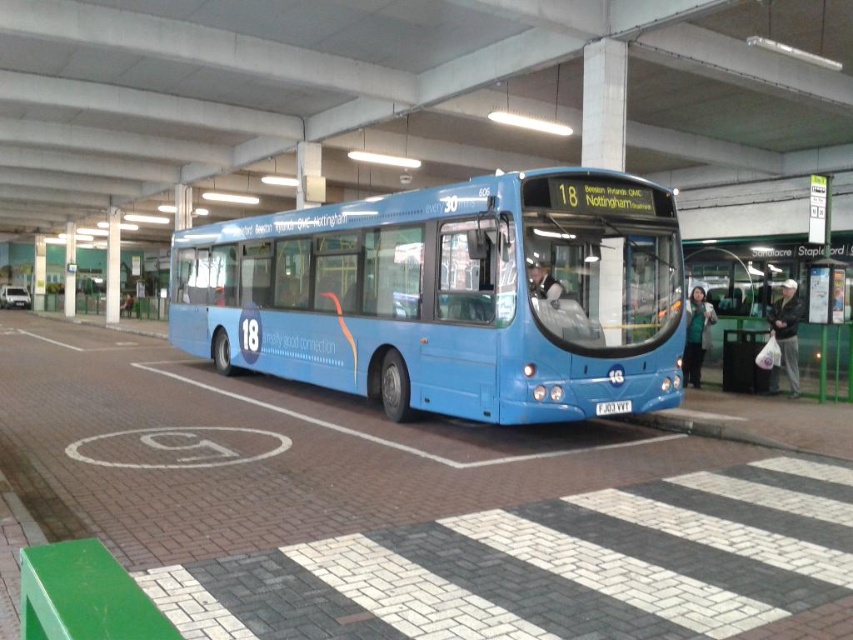
Looking at this image, which is below, matte blue bus at center or green plastic bus stop at center?

matte blue bus at center is lower down.

Looking at this image, can you confirm if matte blue bus at center is bigger than green plastic bus stop at center?

Correct, matte blue bus at center is larger in size than green plastic bus stop at center.

Is point (310, 236) closer to camera compared to point (724, 288)?

Yes.

Locate an element on the screen. This screenshot has height=640, width=853. matte blue bus at center is located at coordinates (451, 296).